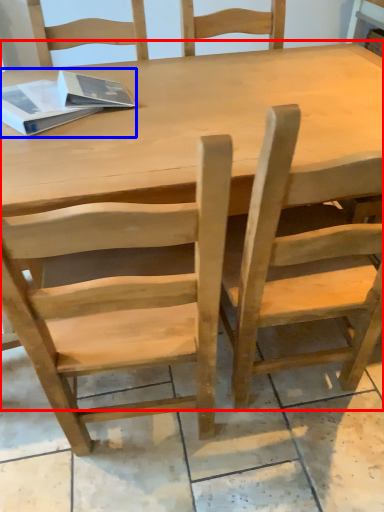
Question: Among these objects, which one is farthest to the camera, table (highlighted by a red box) or book (highlighted by a blue box)?

Choices:
 (A) table
 (B) book

Answer: (B)